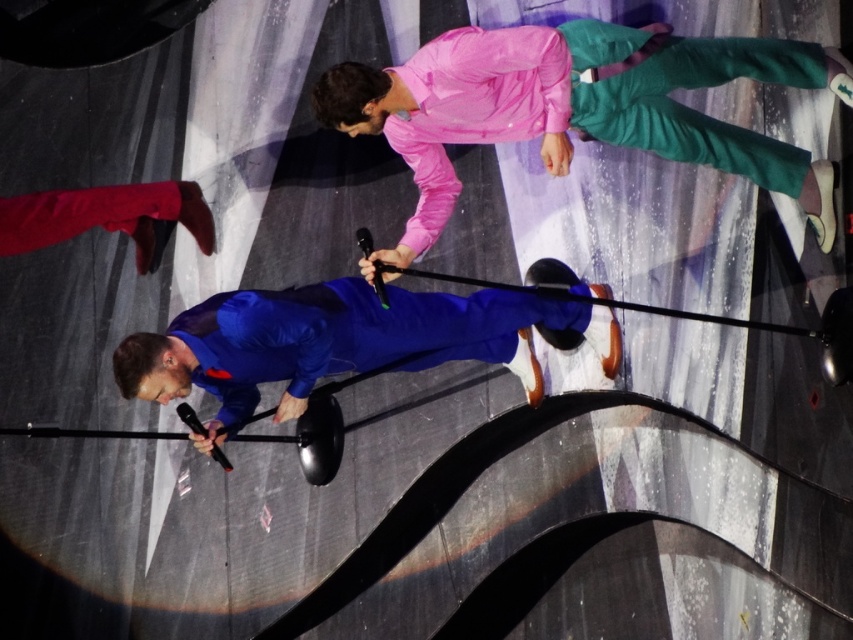
Between pink shiny jacket at upper center and matte blue suit at center, which one is positioned higher?

pink shiny jacket at upper center is above.

Does point (651, 92) come farther from viewer compared to point (250, 305)?

No, (651, 92) is closer to viewer.

What do you see at coordinates (577, 108) in the screenshot? The image size is (853, 640). I see `pink shiny jacket at upper center` at bounding box center [577, 108].

This screenshot has width=853, height=640. What are the coordinates of `pink shiny jacket at upper center` in the screenshot? It's located at (577, 108).